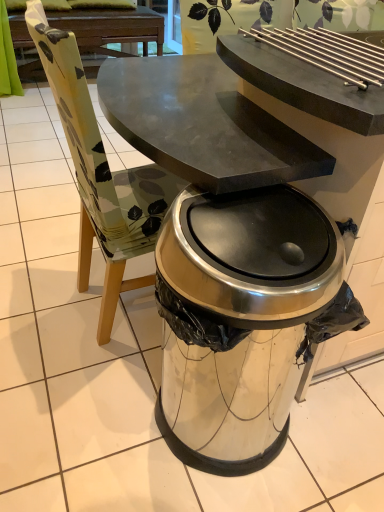
Question: In terms of width, does satin silver trash can at center look wider or thinner when compared to dark brown wood picnic table at upper center?

Choices:
 (A) wide
 (B) thin

Answer: (B)

Question: From the image's perspective, relative to dark brown wood picnic table at upper center, is satin silver trash can at center above or below?

Choices:
 (A) below
 (B) above

Answer: (A)

Question: Looking at the image, does satin silver trash can at center seem bigger or smaller compared to dark brown wood picnic table at upper center?

Choices:
 (A) big
 (B) small

Answer: (B)

Question: Is dark brown wood picnic table at upper center in front of or behind satin silver trash can at center in the image?

Choices:
 (A) behind
 (B) front

Answer: (A)

Question: Is point (112, 13) positioned closer to the camera than point (180, 296)?

Choices:
 (A) farther
 (B) closer

Answer: (A)

Question: From a real-world perspective, is dark brown wood picnic table at upper center positioned above or below satin silver trash can at center?

Choices:
 (A) above
 (B) below

Answer: (B)

Question: In the image, is dark brown wood picnic table at upper center on the left side or the right side of satin silver trash can at center?

Choices:
 (A) left
 (B) right

Answer: (A)